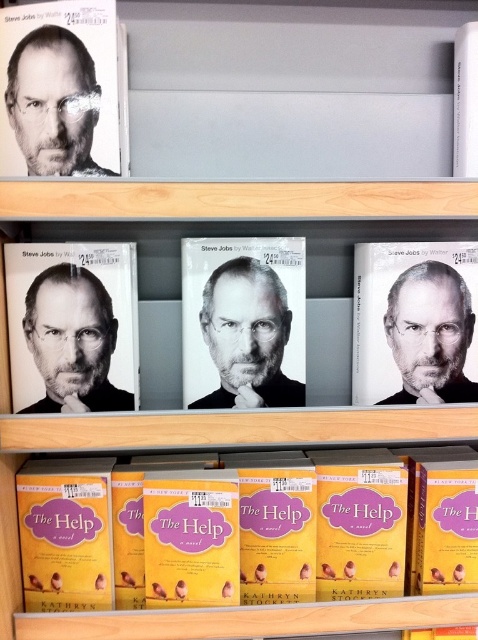
Which is in front, point (381, 449) or point (181, 353)?

Positioned in front is point (181, 353).

Locate an element on the screen. The width and height of the screenshot is (478, 640). yellow matte book at center is located at coordinates (359, 524).

Can you confirm if yellow matte book at lower left is positioned to the right of yellow matte book at center?

In fact, yellow matte book at lower left is to the left of yellow matte book at center.

Is point (69, 513) closer to camera compared to point (337, 525)?

Yes.

The image size is (478, 640). Identify the location of yellow matte book at lower left. (65, 532).

Is point (393, 532) less distant than point (458, 392)?

No.

Between point (218, 576) and point (468, 392), which one is positioned in front?

Point (218, 576) is in front.

You are a GUI agent. You are given a task and a screenshot of the screen. Output one action in this format:
    pyautogui.click(x=<x>, y=<y>)
    Task: Click on the yellow paperbacks at lower center
    Image resolution: width=478 pixels, height=640 pixels.
    Given the screenshot: What is the action you would take?
    pyautogui.click(x=273, y=529)